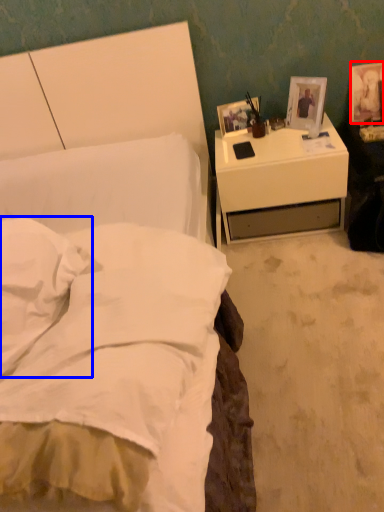
Question: Which of the following is the closest to the observer, picture frame (highlighted by a red box) or pillow (highlighted by a blue box)?

Choices:
 (A) picture frame
 (B) pillow

Answer: (B)